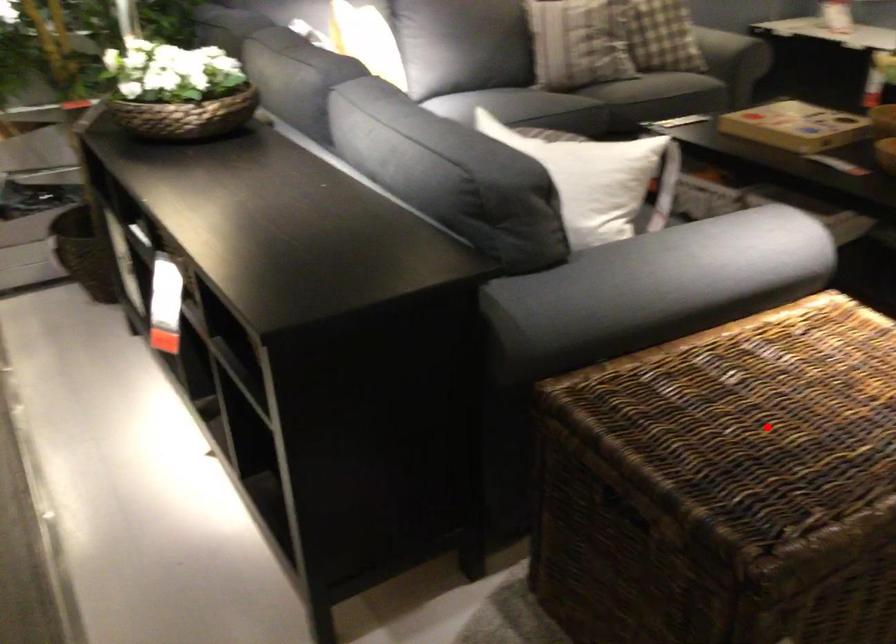
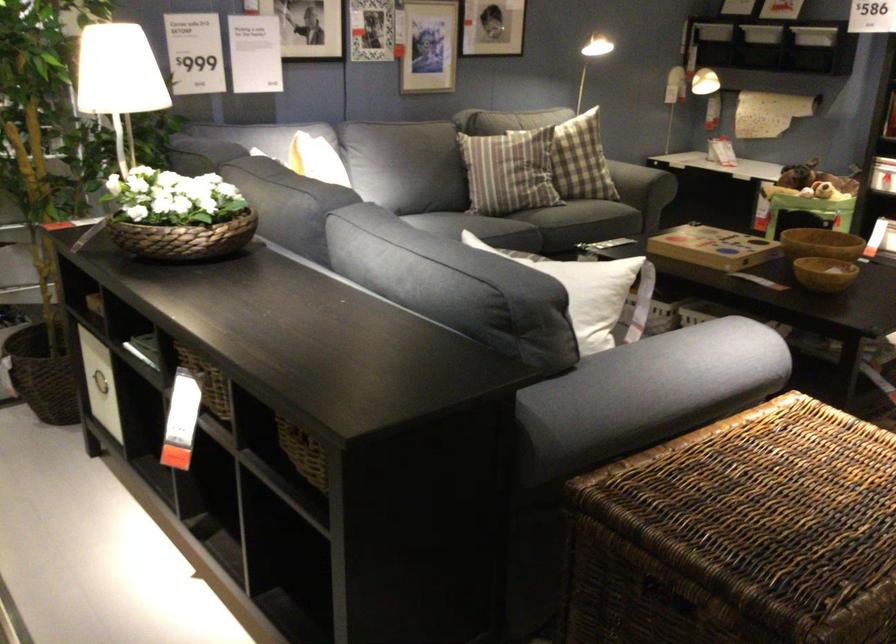
Question: I am providing you with two images of the same scene from different viewpoints. Given a red point in image1, look at the same physical point in image2. Is it:

Choices:
 (A) Closer to the viewpoint
 (B) Farther from the viewpoint

Answer: (B)